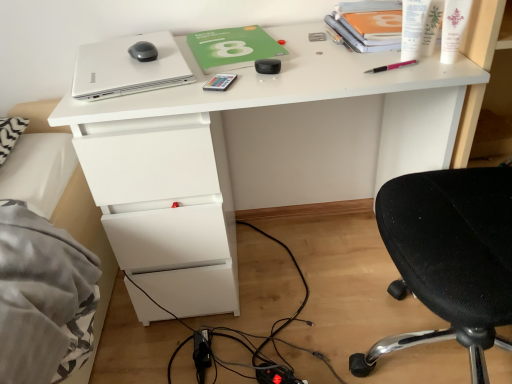
Where is `vacant space in front of metallic rectangular object at center, which is the fourth stationery in right-to-left order`? The width and height of the screenshot is (512, 384). vacant space in front of metallic rectangular object at center, which is the fourth stationery in right-to-left order is located at coordinates (218, 97).